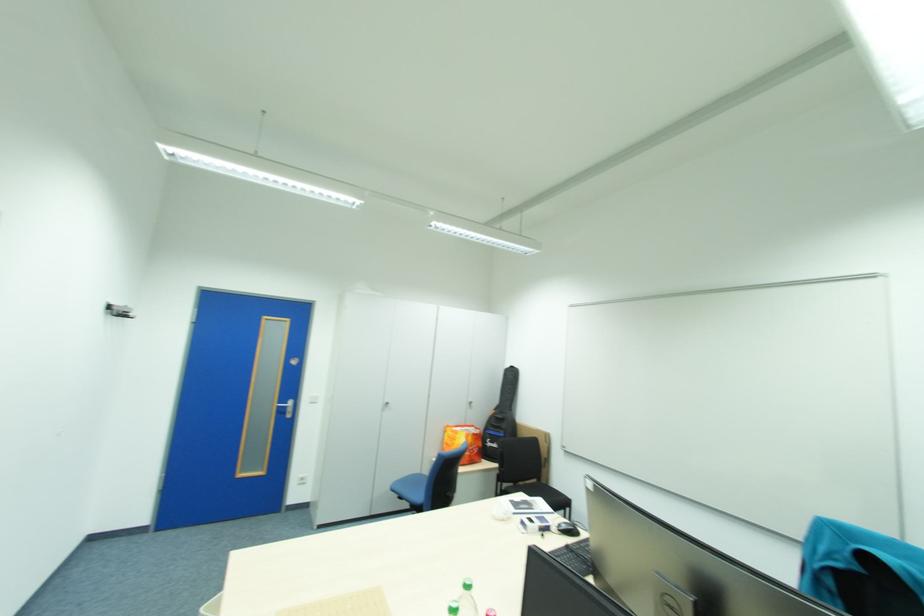
Find where to sit the black chair sitting surface. Please return your answer as a coordinate pair (x, y).

(537, 492)